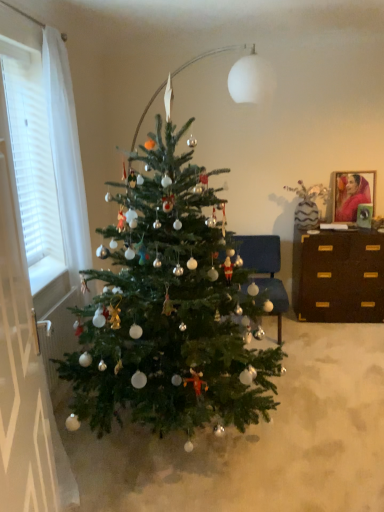
The height and width of the screenshot is (512, 384). Find the location of `white textured curtain at left`. white textured curtain at left is located at coordinates (32, 161).

Consider the image. Considering the relative sizes of green matte christmas tree at center and blue fabric chair at center in the image provided, is green matte christmas tree at center taller than blue fabric chair at center?

Yes.

Considering the positions of objects green matte christmas tree at center and blue fabric chair at center in the image provided, who is behind, green matte christmas tree at center or blue fabric chair at center?

Positioned behind is blue fabric chair at center.

Which object is wider, green matte christmas tree at center or blue fabric chair at center?

With larger width is green matte christmas tree at center.

From a real-world perspective, which is physically below, green matte christmas tree at center or blue fabric chair at center?

blue fabric chair at center.

Is point (355, 218) farther from camera compared to point (182, 389)?

Yes, it is.

Are matte red fabric portrait at upper right and green matte christmas tree at center located far from each other?

Absolutely, matte red fabric portrait at upper right is distant from green matte christmas tree at center.

Is matte red fabric portrait at upper right to the right of green matte christmas tree at center from the viewer's perspective?

Correct, you'll find matte red fabric portrait at upper right to the right of green matte christmas tree at center.

Considering the positions of objects matte red fabric portrait at upper right and green matte christmas tree at center in the image provided, who is behind, matte red fabric portrait at upper right or green matte christmas tree at center?

matte red fabric portrait at upper right is further away from the camera.

From a real-world perspective, which is physically above, green matte christmas tree at center or matte red fabric portrait at upper right?

matte red fabric portrait at upper right, from a real-world perspective.

Would you say green matte christmas tree at center is to the left or to the right of matte red fabric portrait at upper right in the picture?

green matte christmas tree at center is positioned on matte red fabric portrait at upper right's left side.

Would you consider green matte christmas tree at center to be distant from matte red fabric portrait at upper right?

Indeed, green matte christmas tree at center is not near matte red fabric portrait at upper right.

You are a GUI agent. You are given a task and a screenshot of the screen. Output one action in this format:
    pyautogui.click(x=<x>, y=<y>)
    Task: Click on the christmas tree on the left of matte red fabric portrait at upper right
    Image resolution: width=384 pixels, height=512 pixels.
    Given the screenshot: What is the action you would take?
    pyautogui.click(x=169, y=306)

Consider the image. Considering the relative sizes of blue fabric chair at center and white textured curtain at left in the image provided, is blue fabric chair at center thinner than white textured curtain at left?

No.

Can you confirm if blue fabric chair at center is shorter than white textured curtain at left?

Indeed, blue fabric chair at center has a lesser height compared to white textured curtain at left.

Looking at this image, is blue fabric chair at center turned away from white textured curtain at left?

blue fabric chair at center is not turned away from white textured curtain at left.

Is blue fabric chair at center to the right of white textured curtain at left from the viewer's perspective?

Yes.

From the image's perspective, is white textured curtain at left located beneath matte red fabric portrait at upper right?

Yes.

Is point (29, 190) farther from camera compared to point (349, 190)?

That is False.

Between white textured curtain at left and matte red fabric portrait at upper right, which one has less height?

Standing shorter between the two is matte red fabric portrait at upper right.

Can you tell me how much white textured curtain at left and matte red fabric portrait at upper right differ in facing direction?

white textured curtain at left and matte red fabric portrait at upper right are facing 110 degrees away from each other.

At what (x,y) coordinates should I click in order to perform the action: click on desk behind the green matte christmas tree at center. Please return your answer as a coordinate pair (x, y). This screenshot has width=384, height=512. Looking at the image, I should click on coord(338,276).

From a real-world perspective, is brown wood desk at right positioned above or below green matte christmas tree at center?

brown wood desk at right is situated lower than green matte christmas tree at center in the real world.

Considering the positions of objects brown wood desk at right and green matte christmas tree at center in the image provided, who is more to the left, brown wood desk at right or green matte christmas tree at center?

Positioned to the left is green matte christmas tree at center.

Which object is further away from the camera, blue fabric chair at center or matte red fabric portrait at upper right?

matte red fabric portrait at upper right is behind.

Looking at their sizes, would you say blue fabric chair at center is wider or thinner than matte red fabric portrait at upper right?

Clearly, blue fabric chair at center has more width compared to matte red fabric portrait at upper right.

Looking at this image, from the image's perspective, does blue fabric chair at center appear higher than matte red fabric portrait at upper right?

Actually, blue fabric chair at center appears below matte red fabric portrait at upper right in the image.

From a real-world perspective, is blue fabric chair at center positioned above or below matte red fabric portrait at upper right?

blue fabric chair at center is situated lower than matte red fabric portrait at upper right in the real world.

Where is `armchair on the right side of green matte christmas tree at center`? armchair on the right side of green matte christmas tree at center is located at coordinates (265, 269).

This screenshot has width=384, height=512. I want to click on person behind the green matte christmas tree at center, so click(x=353, y=198).

Which object lies further to the anchor point brown wood desk at right, blue fabric chair at center or matte red fabric portrait at upper right?

The object further to brown wood desk at right is matte red fabric portrait at upper right.

Looking at the image, which one is located closer to white textured curtain at left, matte red fabric portrait at upper right or brown wood desk at right?

brown wood desk at right lies closer to white textured curtain at left than the other object.

Estimate the real-world distances between objects in this image. Which object is closer to white textured curtain at left, brown wood desk at right or blue fabric chair at center?

blue fabric chair at center is positioned closer to the anchor white textured curtain at left.

Considering their positions, is blue fabric chair at center positioned further to white textured curtain at left than green matte christmas tree at center?

The object further to white textured curtain at left is blue fabric chair at center.

Based on their spatial positions, is green matte christmas tree at center or matte red fabric portrait at upper right further from brown wood desk at right?

green matte christmas tree at center.

From the image, which object appears to be nearer to white textured curtain at left, blue fabric chair at center or matte red fabric portrait at upper right?

blue fabric chair at center lies closer to white textured curtain at left than the other object.

When comparing their distances from white textured curtain at left, does blue fabric chair at center or brown wood desk at right seem closer?

Based on the image, blue fabric chair at center appears to be nearer to white textured curtain at left.

In the scene shown: Which object lies further to the anchor point matte red fabric portrait at upper right, green matte christmas tree at center or brown wood desk at right?

The object further to matte red fabric portrait at upper right is green matte christmas tree at center.

At what (x,y) coordinates should I click in order to perform the action: click on armchair between green matte christmas tree at center and brown wood desk at right in the front-back direction. Please return your answer as a coordinate pair (x, y). Looking at the image, I should click on point(265,269).

Identify the location of desk between green matte christmas tree at center and matte red fabric portrait at upper right along the z-axis. The height and width of the screenshot is (512, 384). (338, 276).

Identify the location of christmas tree between white textured curtain at left and blue fabric chair at center in the front-back direction. (169, 306).

Where is `armchair between green matte christmas tree at center and matte red fabric portrait at upper right in the front-back direction`? This screenshot has height=512, width=384. armchair between green matte christmas tree at center and matte red fabric portrait at upper right in the front-back direction is located at coordinates (265, 269).